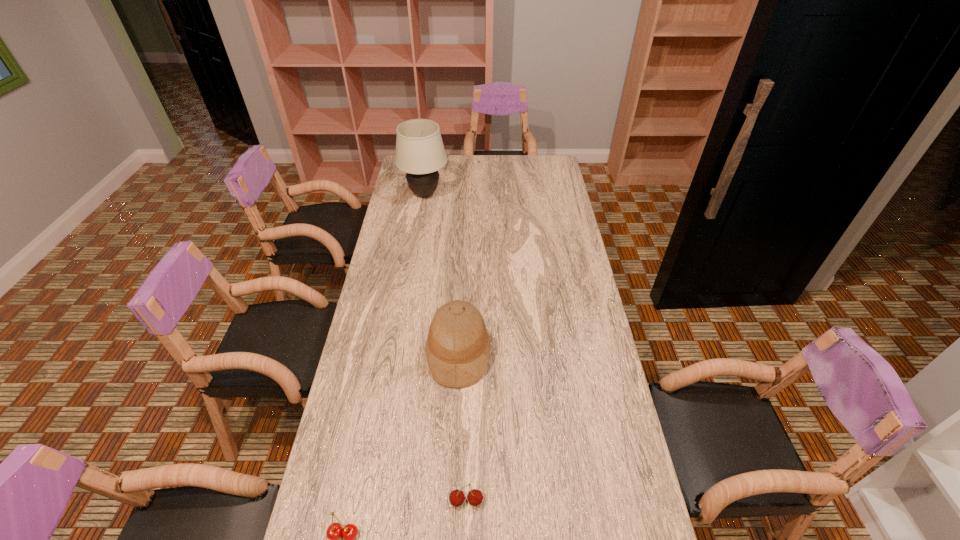
This screenshot has width=960, height=540. In order to click on lampshade in this screenshot , I will do `click(420, 152)`.

You are a GUI agent. You are given a task and a screenshot of the screen. Output one action in this format:
    pyautogui.click(x=<x>, y=<y>)
    Task: Click on the farthest object
    This screenshot has height=540, width=960.
    Given the screenshot: What is the action you would take?
    pyautogui.click(x=420, y=152)

Find the location of a particular element. the third shortest object is located at coordinates (458, 346).

At what (x,y) coordinates should I click in order to perform the action: click on the third nearest object. Please return your answer as a coordinate pair (x, y). This screenshot has height=540, width=960. Looking at the image, I should click on (458, 346).

The width and height of the screenshot is (960, 540). Identify the location of the right cherry. (475, 497).

Where is `the farther cherry`? This screenshot has height=540, width=960. the farther cherry is located at coordinates (475, 497).

At what (x,y) coordinates should I click in order to perform the action: click on free space located 0.220m on the right of the tallest object. Please return your answer as a coordinate pair (x, y). This screenshot has height=540, width=960. Looking at the image, I should click on (494, 194).

Image resolution: width=960 pixels, height=540 pixels. I want to click on vacant space located on the front-facing side of the hat, so click(x=590, y=354).

This screenshot has width=960, height=540. In order to click on vacant space located on the surface of the third farthest object in this screenshot , I will do `click(466, 536)`.

The height and width of the screenshot is (540, 960). I want to click on object situated at the left edge, so click(x=420, y=152).